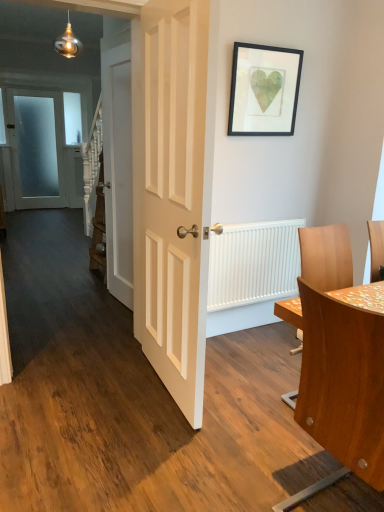
Find the location of a particular element. This screenshot has width=384, height=512. vacant space positioned to the left of wooden table at right is located at coordinates (234, 445).